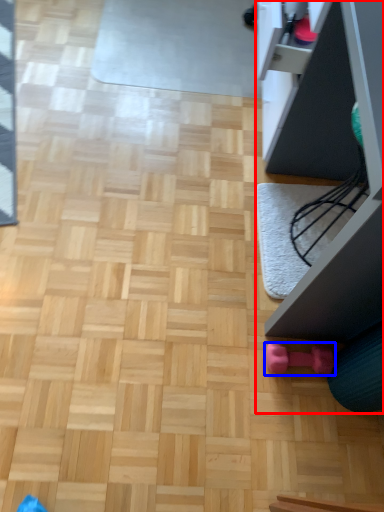
Question: Which point is further to the camera, furniture (highlighted by a red box) or toy (highlighted by a blue box)?

Choices:
 (A) furniture
 (B) toy

Answer: (B)